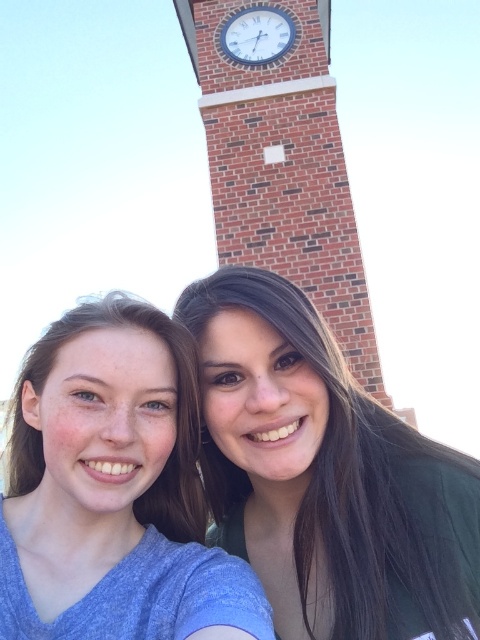
Question: Can you confirm if matte green shirt at lower right is positioned to the right of brick clock tower at center?

Choices:
 (A) yes
 (B) no

Answer: (B)

Question: Is matte green shirt at lower right above white glossy clock at upper center?

Choices:
 (A) no
 (B) yes

Answer: (A)

Question: Which object is positioned farthest from the white glossy clock at upper center?

Choices:
 (A) matte blue shirt at lower left
 (B) brick clock tower at center

Answer: (A)

Question: Which of these objects is positioned closest to the white glossy clock at upper center?

Choices:
 (A) matte green shirt at lower right
 (B) brick clock tower at center

Answer: (B)

Question: Does matte green shirt at lower right appear on the left side of white glossy clock at upper center?

Choices:
 (A) yes
 (B) no

Answer: (B)

Question: Among these points, which one is nearest to the camera?

Choices:
 (A) (261, 19)
 (B) (354, 298)
 (C) (61, 504)

Answer: (C)